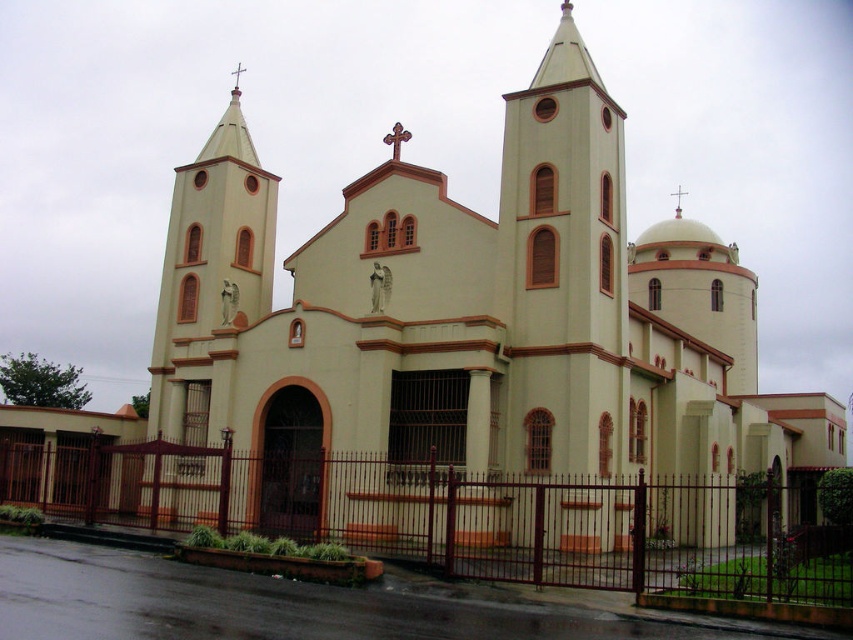
Question: Which of the following is the farthest from the observer?

Choices:
 (A) beige stucco church at center
 (B) wooden cross at center
 (C) metallic gold cross at upper center

Answer: (C)

Question: Which of the following is the farthest from the observer?

Choices:
 (A) wooden cross at center
 (B) metallic cross at upper center

Answer: (B)

Question: From the image, what is the correct spatial relationship of beige stucco church at center in relation to metallic gold cross at upper center?

Choices:
 (A) right
 (B) left

Answer: (B)

Question: Is brown metal fence at lower center to the right of metallic gold cross at upper center from the viewer's perspective?

Choices:
 (A) no
 (B) yes

Answer: (A)

Question: Which point is closer to the camera?

Choices:
 (A) (645, 440)
 (B) (395, 154)
 (C) (682, 195)

Answer: (A)

Question: Is beige stucco church at center to the left of brown metal fence at lower center from the viewer's perspective?

Choices:
 (A) no
 (B) yes

Answer: (A)